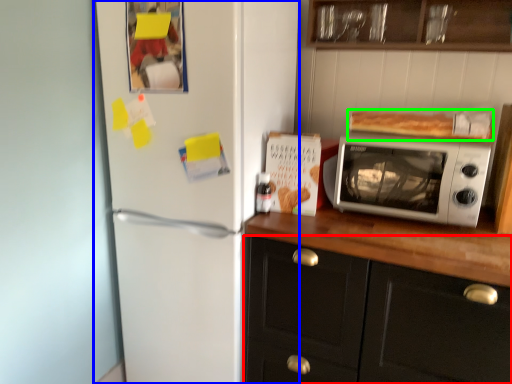
Question: Which object is positioned farthest from cabinetry (highlighted by a red box)? Select from refrigerator (highlighted by a blue box) and food (highlighted by a green box).

Choices:
 (A) refrigerator
 (B) food

Answer: (B)